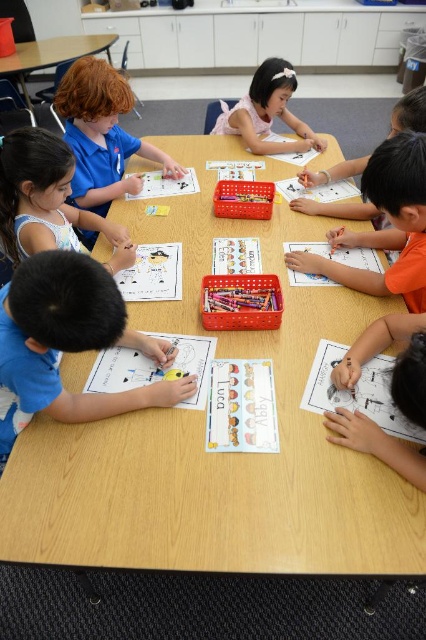
Between wooden table at center and blue shirt at upper left, which one is positioned higher?

blue shirt at upper left

The width and height of the screenshot is (426, 640). In order to click on wooden table at center in this screenshot , I will do `click(204, 438)`.

Who is more forward, (354,518) or (371,276)?

Point (354,518)

Is wooden table at center taller than orange matte shirt at right?

Indeed, wooden table at center has a greater height compared to orange matte shirt at right.

Does point (77, 556) come in front of point (411, 156)?

Yes, it is in front of point (411, 156).

The height and width of the screenshot is (640, 426). What are the coordinates of `wooden table at center` in the screenshot? It's located at (204, 438).

In the scene shown: Is orange matte shirt at right shorter than pink fabric dress at upper center?

No, orange matte shirt at right is not shorter than pink fabric dress at upper center.

Describe the element at coordinates (385, 228) in the screenshot. I see `orange matte shirt at right` at that location.

In order to click on orange matte shirt at right in this screenshot , I will do tap(385, 228).